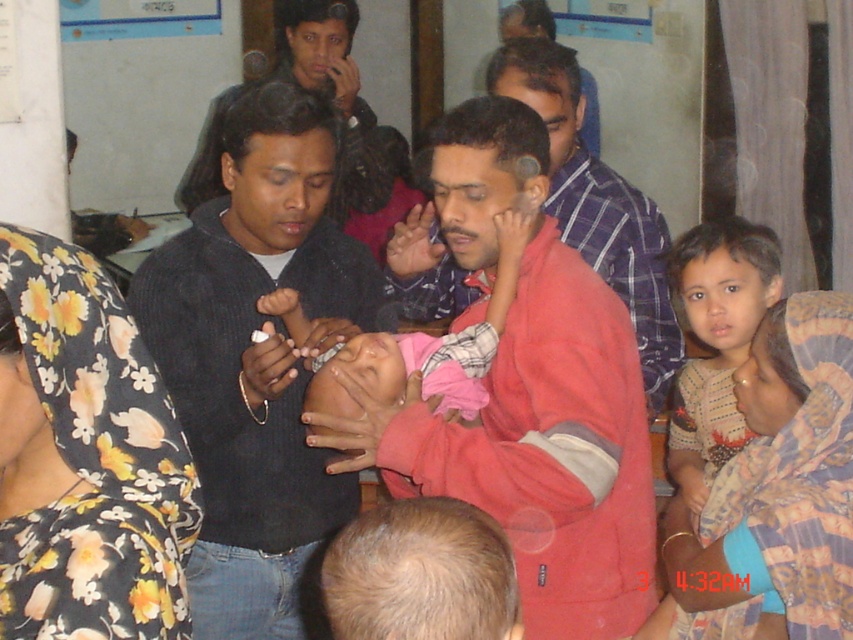
Who is taller, black matte sweater at upper center or pink fabric baby at center?

black matte sweater at upper center is taller.

Between black matte sweater at upper center and pink fabric baby at center, which one appears on the left side from the viewer's perspective?

Positioned to the left is black matte sweater at upper center.

Which is in front, point (357, 99) or point (514, 268)?

Point (514, 268) is more forward.

Where is `black matte sweater at upper center`? black matte sweater at upper center is located at coordinates (312, 92).

Is red fleece jacket at center bigger than black matte sweater at upper center?

No.

Is red fleece jacket at center to the left of black matte sweater at upper center from the viewer's perspective?

Incorrect, red fleece jacket at center is not on the left side of black matte sweater at upper center.

Does point (584, 333) lie behind point (209, 156)?

No.

Image resolution: width=853 pixels, height=640 pixels. I want to click on red fleece jacket at center, so click(540, 449).

Is printed fabric baby at center thinner than light brown fabric shirt at right?

In fact, printed fabric baby at center might be wider than light brown fabric shirt at right.

The height and width of the screenshot is (640, 853). Identify the location of printed fabric baby at center. (775, 493).

Where is `printed fabric baby at center`? Image resolution: width=853 pixels, height=640 pixels. printed fabric baby at center is located at coordinates (775, 493).